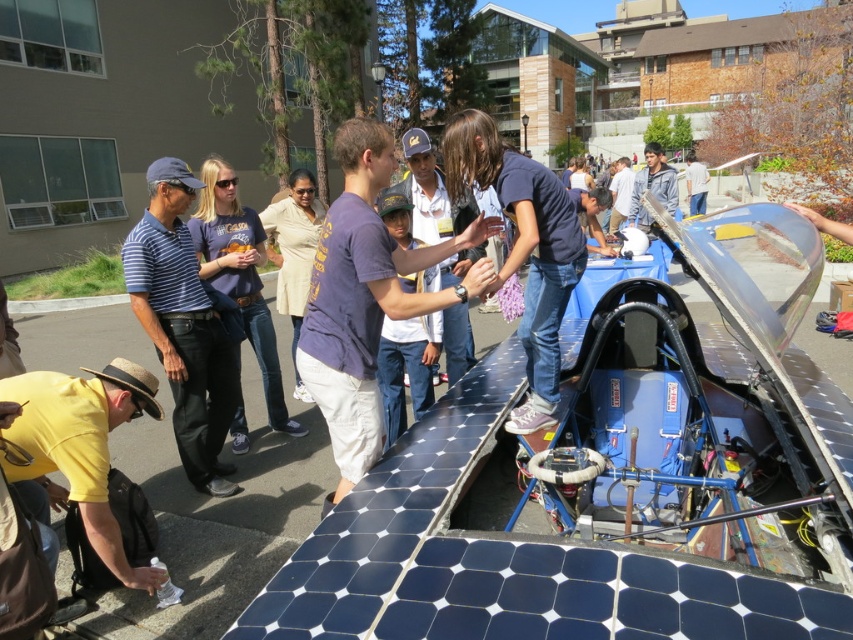
Based on the photo, you are a photographer at the event and want to capture a photo that includes both the purple cotton shirt at center and the blue striped shirt at left. Based on their positions, which shirt should be placed higher in the frame to include both?

The purple cotton shirt at center is already positioned above the blue striped shirt at left, so to include both in the frame, the photographer should ensure the upper part of the frame captures the purple cotton shirt at center while leaving space below for the blue striped shirt at left.

You are a photographer trying to capture a group photo of the purple cotton shirt at center and the blue striped shirt at left. If you want to ensure both subjects are fully visible in the frame without cropping, which person should you position closer to the camera to avoid overlapping?

The purple cotton shirt at center might be wider than blue striped shirt at left, so positioning the purple cotton shirt at center closer to the camera would help avoid overlap since it is wider and needs more space in the frame.